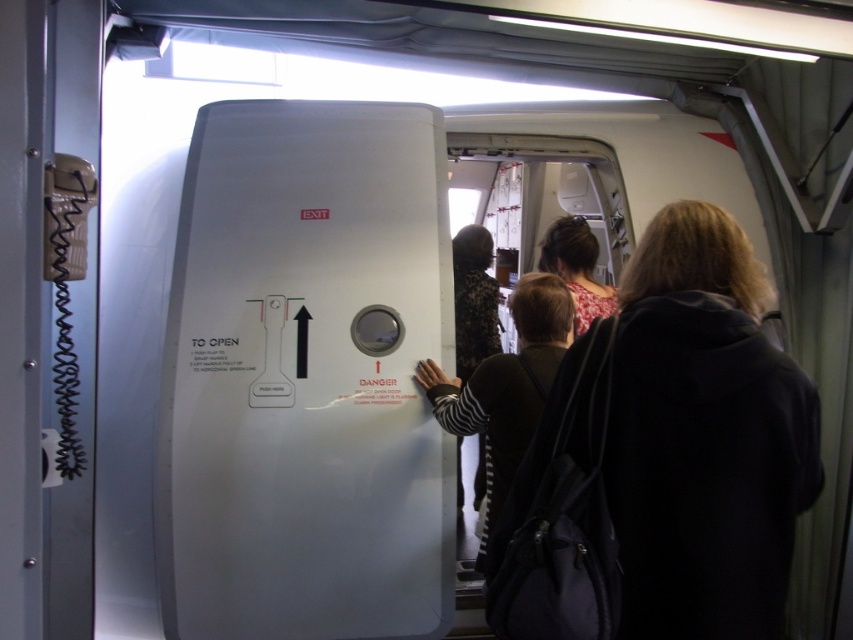
Can you confirm if dark brown hair at center is smaller than floral-patterned fabric dress at center?

No, dark brown hair at center is not smaller than floral-patterned fabric dress at center.

Who is taller, dark brown hair at center or floral-patterned fabric dress at center?

With more height is dark brown hair at center.

I want to click on dark brown hair at center, so click(x=704, y=436).

Between floral-patterned fabric dress at center and floral fabric dress at center, which one appears on the right side from the viewer's perspective?

floral fabric dress at center is more to the right.

Which is behind, point (456, 234) or point (566, 220)?

Positioned behind is point (456, 234).

Does point (474, 289) come closer to viewer compared to point (582, 240)?

That is False.

Locate an element on the screen. The image size is (853, 640). floral-patterned fabric dress at center is located at coordinates point(473,300).

Who is more distant from viewer, (622,452) or (598,285)?

The point (598,285) is more distant.

Can you confirm if dark brown hair at center is positioned above floral fabric dress at center?

No.

Who is more forward, [718,410] or [583,291]?

Point [718,410] is in front.

Identify the location of dark brown hair at center. This screenshot has width=853, height=640. (704, 436).